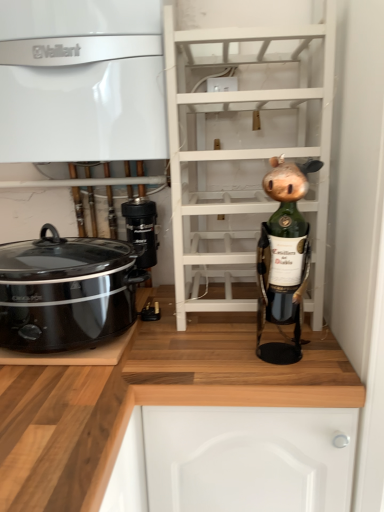
Find the location of a particular element. free space to the back side of green matte wine bottle at right is located at coordinates (248, 329).